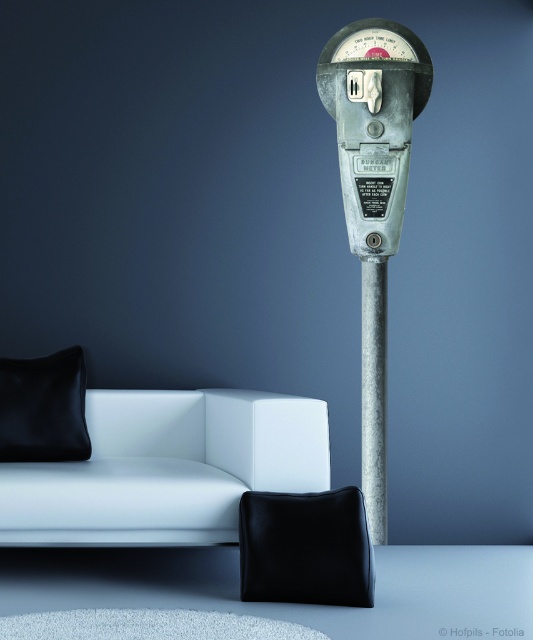
What do you see at coordinates (166, 468) in the screenshot? The width and height of the screenshot is (533, 640). I see `white leather couch at lower left` at bounding box center [166, 468].

Does white leather couch at lower left lie behind metallic parking meter at center?

No, white leather couch at lower left is in front of metallic parking meter at center.

At what (x,y) coordinates should I click in order to perform the action: click on white leather couch at lower left. Please return your answer as a coordinate pair (x, y). The image size is (533, 640). Looking at the image, I should click on (166, 468).

From the picture: Does metallic parking meter at center come behind black leather pillow at lower left?

Yes, it is.

Which of these two, metallic parking meter at center or black leather pillow at lower left, stands shorter?

With less height is black leather pillow at lower left.

Is point (399, 38) positioned after point (69, 404)?

Yes, point (399, 38) is farther from viewer.

You are a GUI agent. You are given a task and a screenshot of the screen. Output one action in this format:
    pyautogui.click(x=<x>, y=<y>)
    Task: Click on the metallic parking meter at center
    The height and width of the screenshot is (640, 533).
    Given the screenshot: What is the action you would take?
    pyautogui.click(x=374, y=124)

Consider the image. Does white leather couch at lower left have a smaller size compared to black leather cushion at lower center?

No.

Between white leather couch at lower left and black leather cushion at lower center, which one appears on the left side from the viewer's perspective?

Positioned to the left is white leather couch at lower left.

Is point (203, 458) more distant than point (273, 595)?

That is True.

At what (x,y) coordinates should I click in order to perform the action: click on white leather couch at lower left. Please return your answer as a coordinate pair (x, y). This screenshot has width=533, height=640. Looking at the image, I should click on (166, 468).